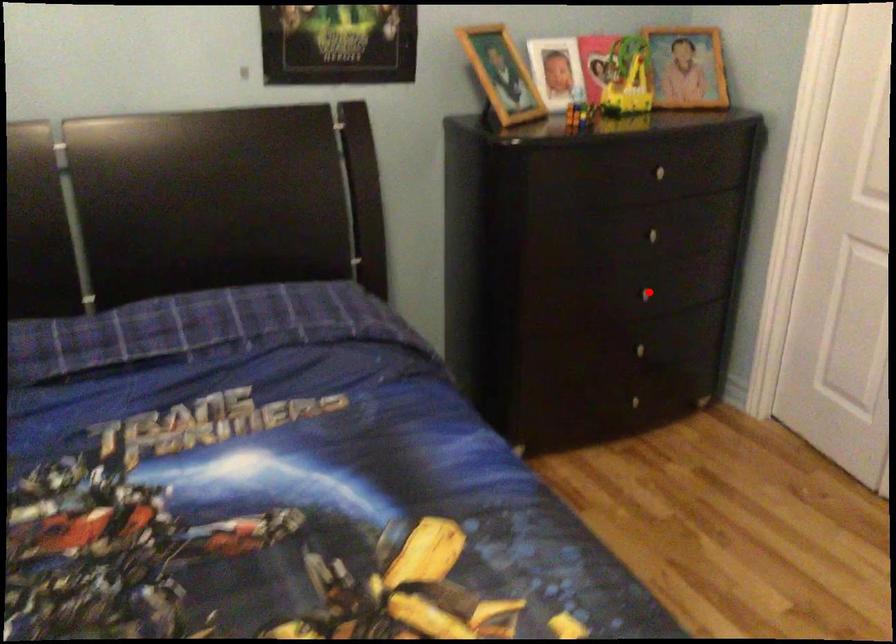
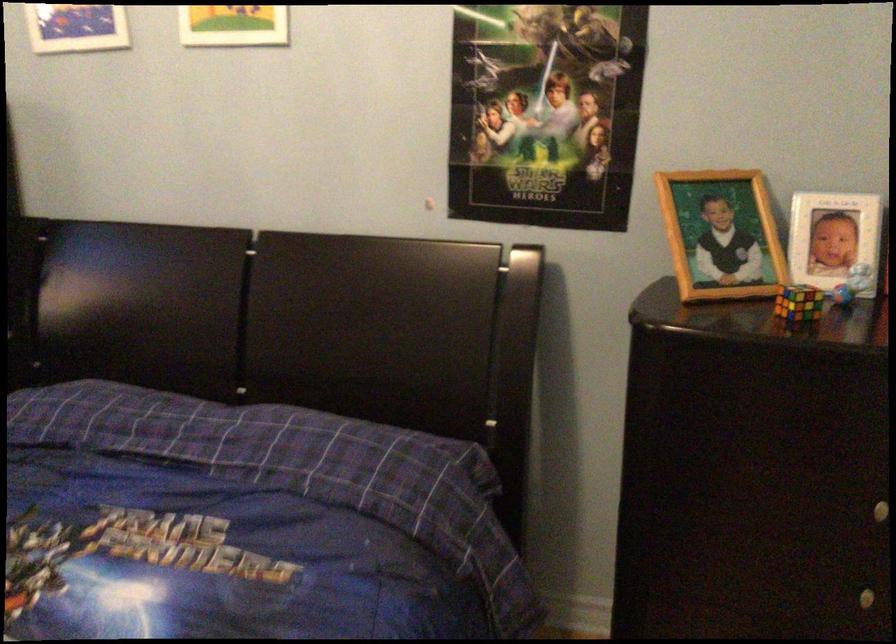
The point at the highlighted location is marked in the first image. Where is the corresponding point in the second image?

(868, 597)